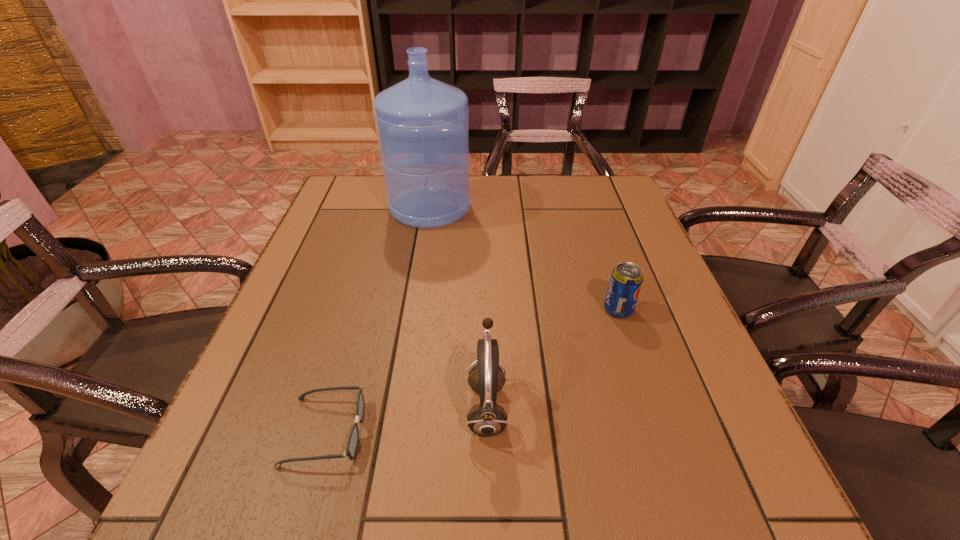
Image resolution: width=960 pixels, height=540 pixels. In the image, there is a desktop. Find the location of `vacant space at the left edge`. vacant space at the left edge is located at coordinates (272, 396).

This screenshot has width=960, height=540. Find the location of `vacant space at the right edge of the desktop`. vacant space at the right edge of the desktop is located at coordinates [x=681, y=333].

In the image, there is a desktop. At what (x,y) coordinates should I click in order to perform the action: click on vacant area at the far left corner. Please return your answer as a coordinate pair (x, y). The width and height of the screenshot is (960, 540). Looking at the image, I should click on (338, 187).

The image size is (960, 540). Find the location of `free space at the far right corner`. free space at the far right corner is located at coordinates (578, 190).

Locate an element on the screen. free spot between the tallest object and the second tallest object is located at coordinates (459, 307).

This screenshot has width=960, height=540. I want to click on vacant space that is in between the water jug and the soda, so click(x=524, y=259).

Locate an element on the screen. The image size is (960, 540). vacant space that is in between the shortest object and the second tallest object is located at coordinates (406, 419).

Identify the location of vacant area that lies between the water jug and the second tallest object. Image resolution: width=960 pixels, height=540 pixels. (459, 307).

The image size is (960, 540). I want to click on free space between the third shortest object and the farthest object, so click(459, 307).

Locate an element on the screen. Image resolution: width=960 pixels, height=540 pixels. free space between the third nearest object and the second tallest object is located at coordinates (553, 359).